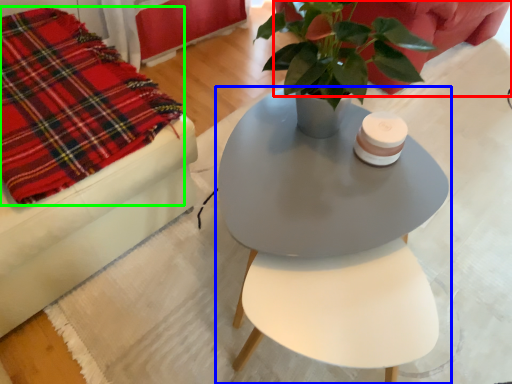
Question: Based on their relative distances, which object is nearer to couch (highlighted by a red box)? Choose from table (highlighted by a blue box) and cloth (highlighted by a green box).

Choices:
 (A) table
 (B) cloth

Answer: (A)